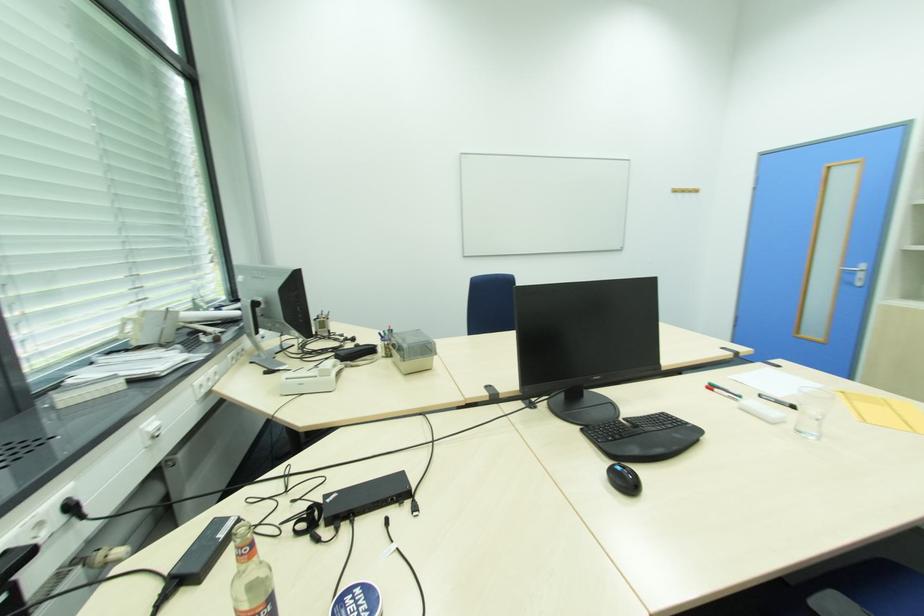
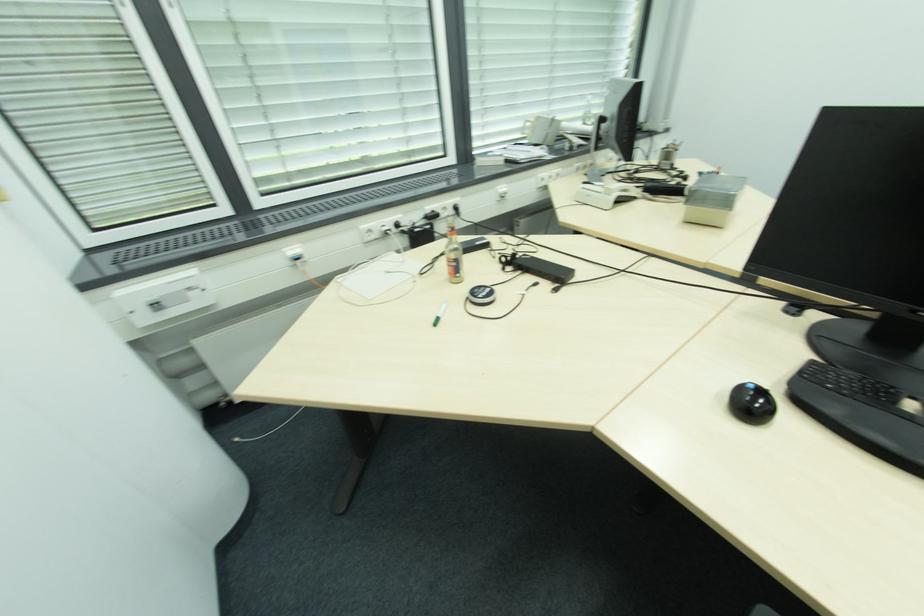
Locate, in the second image, the point that corresponds to pixel 327 374 in the first image.

(612, 193)